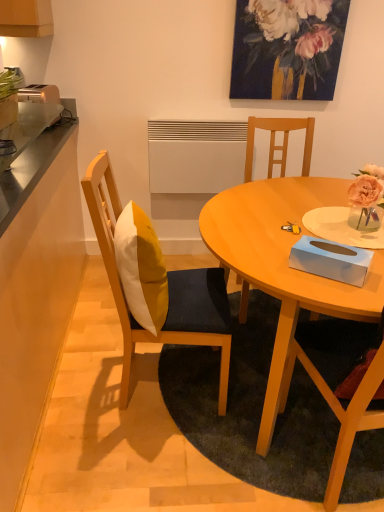
Image resolution: width=384 pixels, height=512 pixels. In order to click on vacant space situated on the left part of wooden chair with cushion at left, acting as the 1th chair starting from the left in this screenshot , I will do `click(84, 374)`.